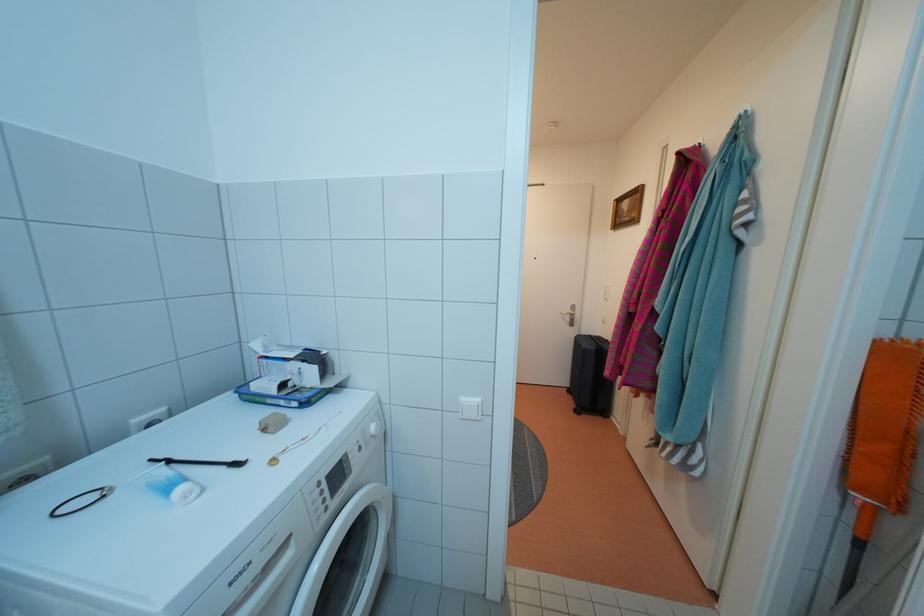
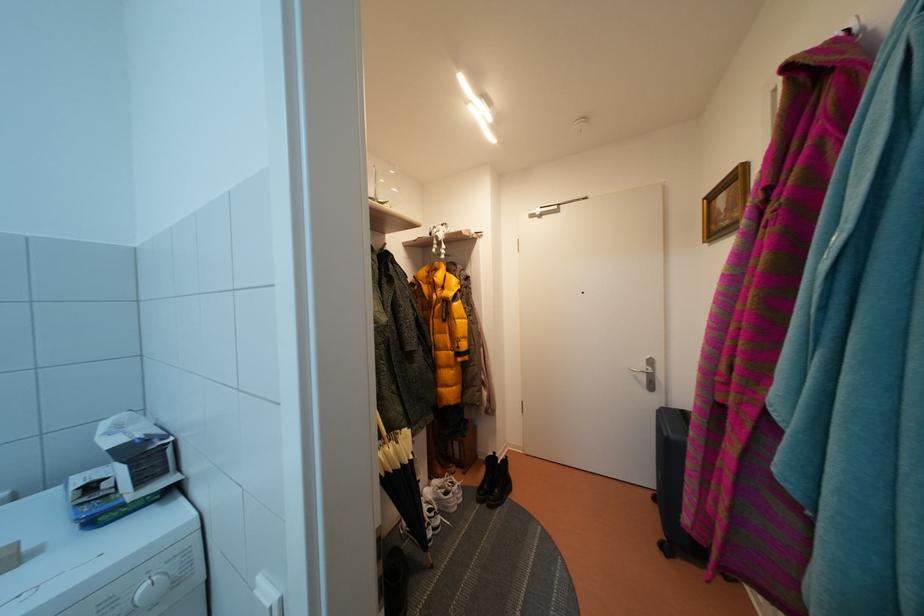
In the second image, find the point that corresponds to the point at 576,315 in the first image.

(650, 371)